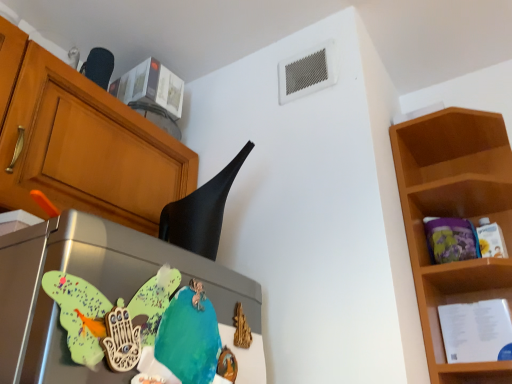
The width and height of the screenshot is (512, 384). Identify the location of blank space situated above wooden shelf at right (from a real-world perspective). (440, 143).